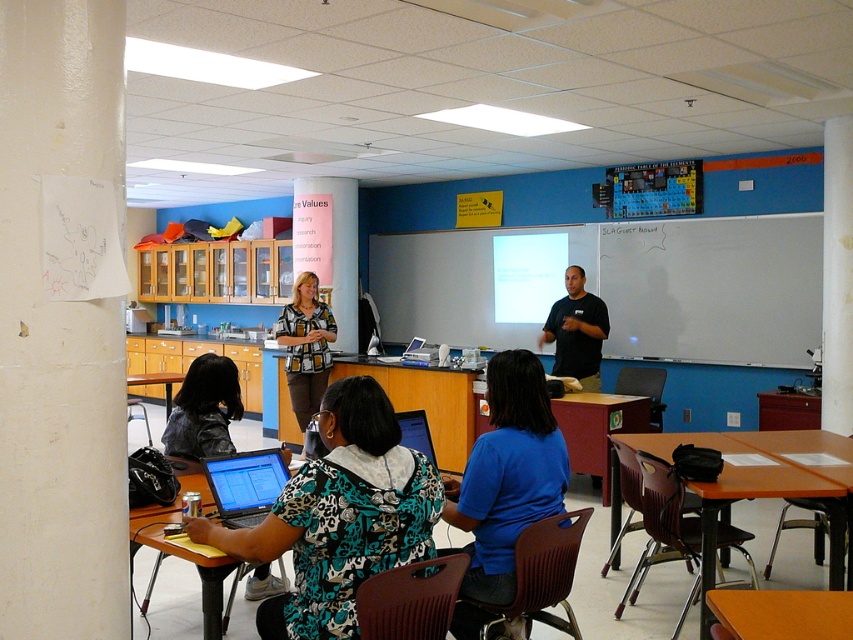
Measure the distance between printed fabric shirt at center and camera.

printed fabric shirt at center is 2.19 meters from camera.

Is printed fabric shirt at center wider than black matte shirt at center?

Indeed, printed fabric shirt at center has a greater width compared to black matte shirt at center.

Between point (427, 556) and point (601, 301), which one is positioned in front?

Positioned in front is point (427, 556).

I want to click on printed fabric shirt at center, so click(x=339, y=516).

Can you confirm if printed fabric blouse at center is wider than black matte shirt at center?

No.

Which is below, printed fabric blouse at center or black matte shirt at center?

printed fabric blouse at center is lower down.

This screenshot has height=640, width=853. I want to click on printed fabric blouse at center, so click(306, 346).

Measure the distance between point (527, 484) and camera.

The distance of point (527, 484) from camera is 2.75 meters.

Does point (466, 596) come closer to viewer compared to point (589, 352)?

Yes, it is in front of point (589, 352).

Is point (460, 509) farther from viewer compared to point (556, 324)?

That is False.

At what (x,y) coordinates should I click in order to perform the action: click on blue fabric shirt at center. Please return your answer as a coordinate pair (x, y). Looking at the image, I should click on (508, 476).